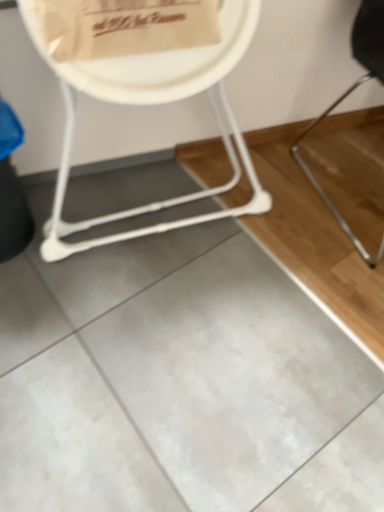
Find the location of `free space in front of black metal chair at right, the 2th chair positioned from the left`. free space in front of black metal chair at right, the 2th chair positioned from the left is located at coordinates (323, 298).